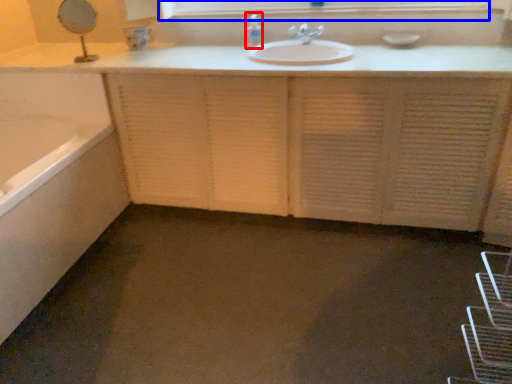
Question: Which object appears closest to the camera in this image, soap dispenser (highlighted by a red box) or medicine cabinet (highlighted by a blue box)?

Choices:
 (A) soap dispenser
 (B) medicine cabinet

Answer: (B)